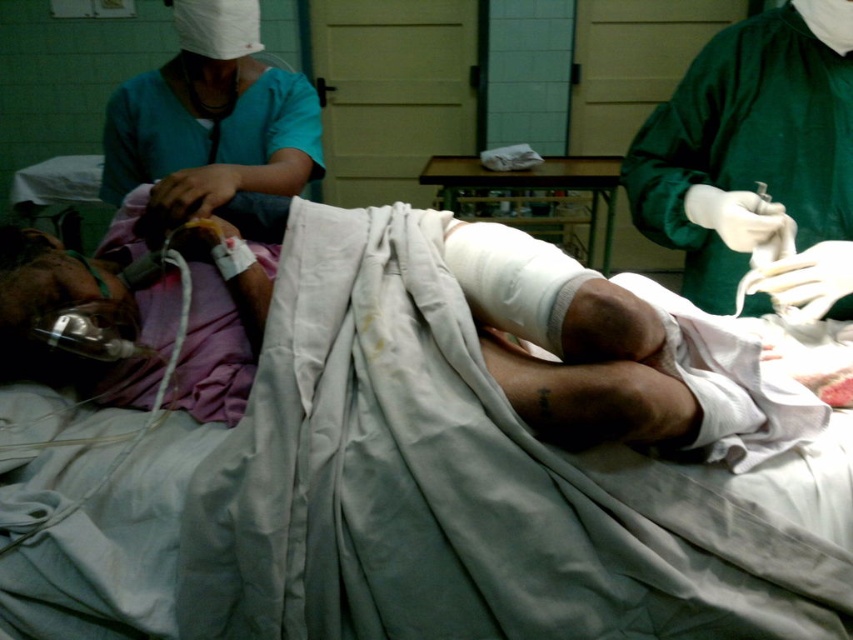
Question: In this image, where is green smooth surgical gown at right located relative to teal fabric uniform at upper left?

Choices:
 (A) right
 (B) left

Answer: (A)

Question: Is green smooth surgical gown at right smaller than teal fabric uniform at upper left?

Choices:
 (A) no
 (B) yes

Answer: (B)

Question: Is white bandaged leg at center to the right of green smooth surgical gown at right from the viewer's perspective?

Choices:
 (A) yes
 (B) no

Answer: (B)

Question: Which object is positioned closest to the teal fabric uniform at upper left?

Choices:
 (A) white bandaged leg at center
 (B) green smooth surgical gown at right

Answer: (A)

Question: Among these points, which one is farthest from the camera?

Choices:
 (A) (251, 188)
 (B) (28, 304)
 (C) (695, 113)

Answer: (C)

Question: Which of these objects is positioned closest to the teal fabric uniform at upper left?

Choices:
 (A) white bandaged leg at center
 (B) green smooth surgical gown at right

Answer: (A)